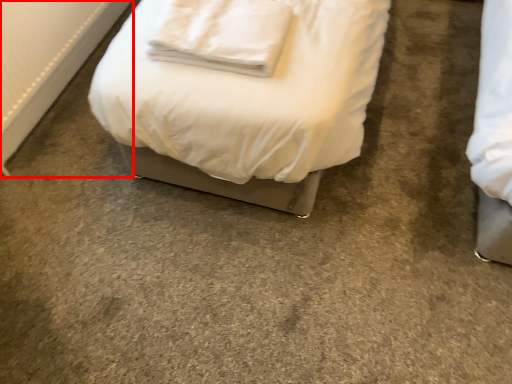
Question: Considering the relative positions of radiator (annotated by the red box) and pillow in the image provided, where is radiator (annotated by the red box) located with respect to the staircase?

Choices:
 (A) right
 (B) left

Answer: (B)